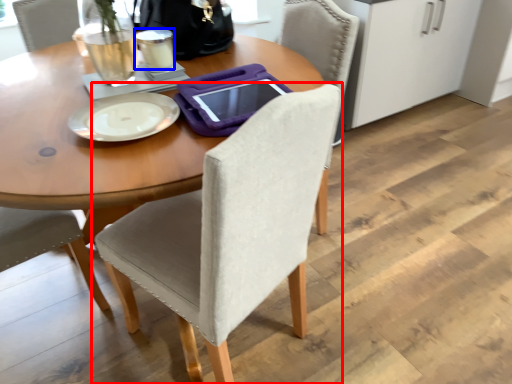
Question: Which object is further to the camera taking this photo, chair (highlighted by a red box) or coffee cup (highlighted by a blue box)?

Choices:
 (A) chair
 (B) coffee cup

Answer: (B)